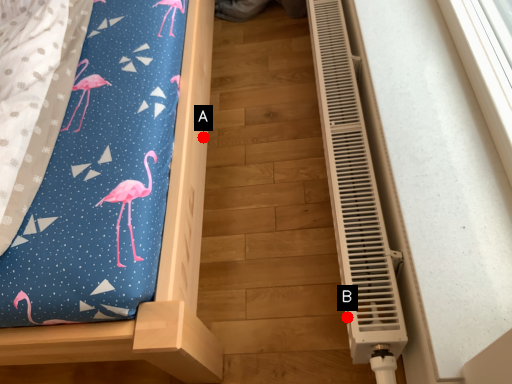
Question: Two points are circled on the image, labeled by A and B beside each circle. Among these points, which one is nearest to the camera?

Choices:
 (A) A is closer
 (B) B is closer

Answer: (B)